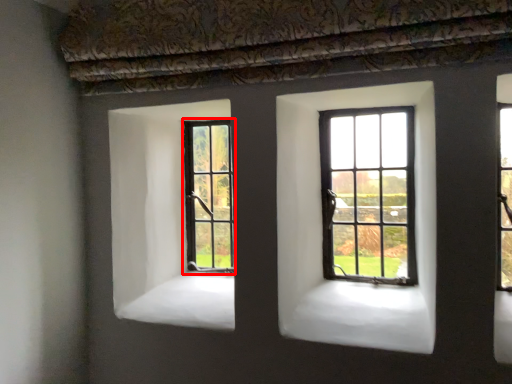
Question: From the image's perspective, where is window (annotated by the red box) located in relation to window in the image?

Choices:
 (A) above
 (B) below

Answer: (B)